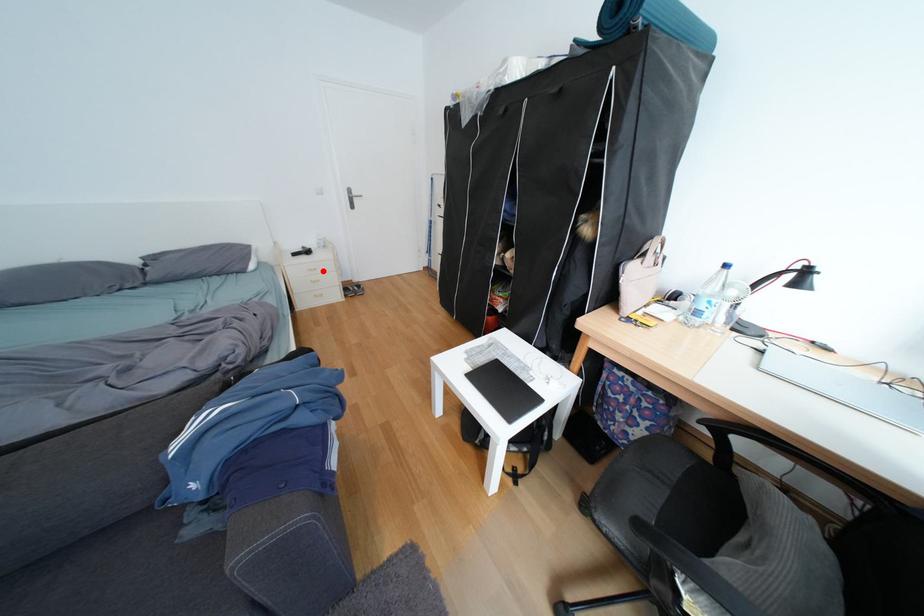
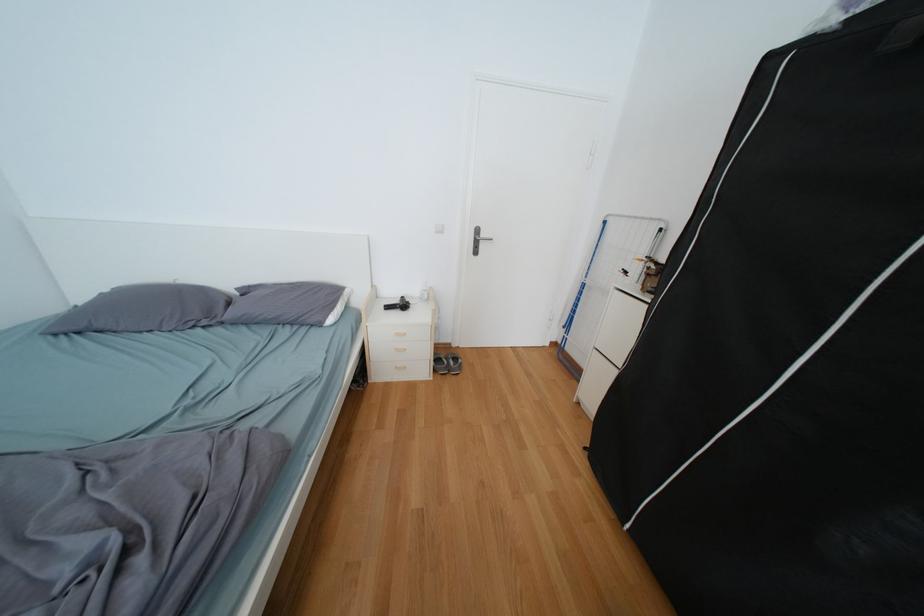
Question: I am providing you with two images of the same scene from different viewpoints. Image1 has a red point marked. In image2, the corresponding 3D location appears at what relative position? Reply with the corresponding letter.

Choices:
 (A) Closer
 (B) Farther

Answer: (B)